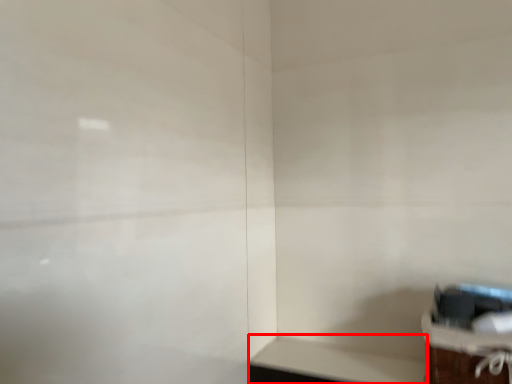
Question: Where is table (annotated by the red box) located in relation to furniture in the image?

Choices:
 (A) right
 (B) left

Answer: (B)